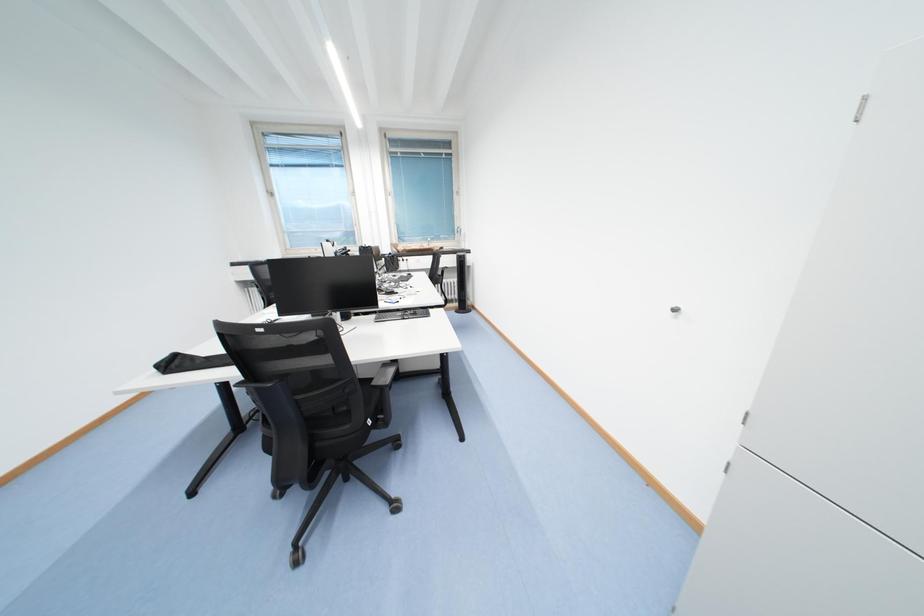
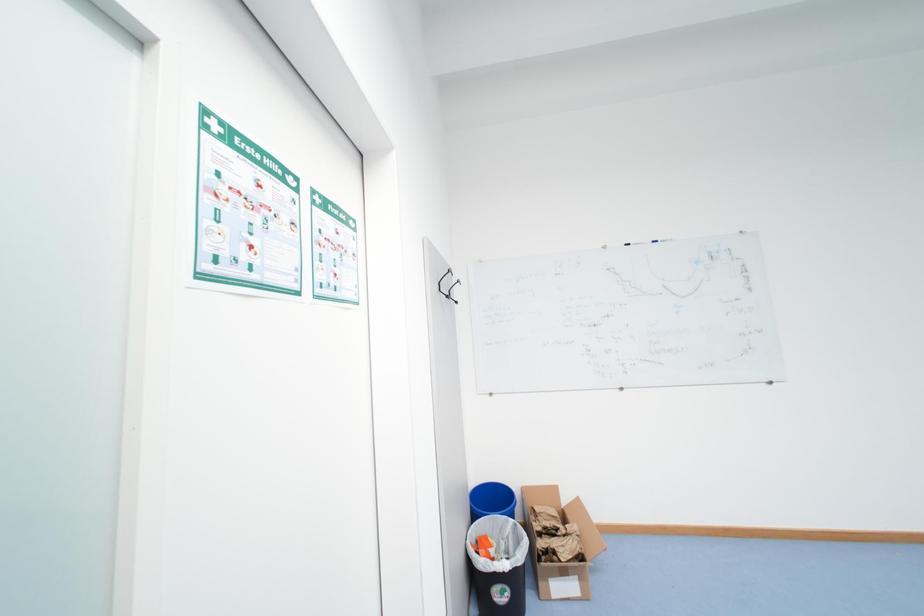
Question: The images are taken continuously from a first-person perspective. In which direction is your viewpoint rotating?

Choices:
 (A) Left
 (B) Right
 (C) Up
 (D) Down

Answer: (A)